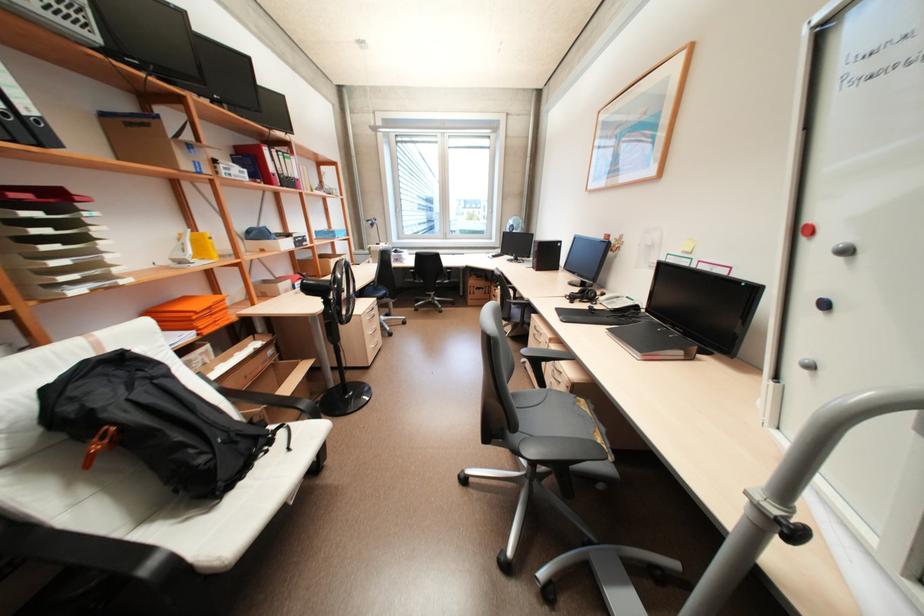
At what (x,y) coordinates should I click in order to perform the action: click on blue magnet. Please return your answer as a coordinate pair (x, y). This screenshot has width=924, height=616. Looking at the image, I should click on (823, 304).